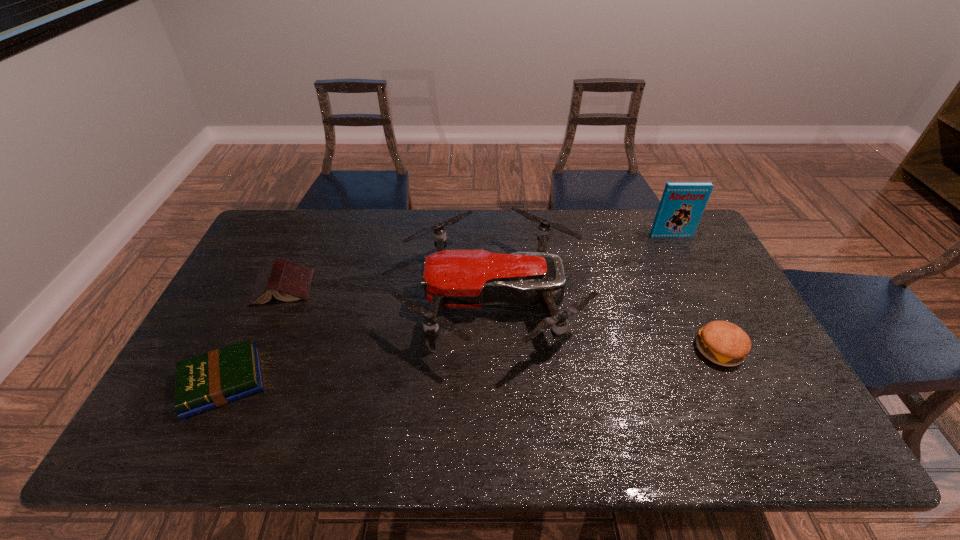
Where is `hamburger that is at the right edge`? hamburger that is at the right edge is located at coordinates (724, 343).

Identify the location of object that is at the near left corner. (213, 379).

Where is `object located at the far right corner`? This screenshot has height=540, width=960. object located at the far right corner is located at coordinates (682, 204).

I want to click on free location at the far edge of the desktop, so click(410, 244).

Find the location of a particular element. This screenshot has height=540, width=960. vacant area at the near edge is located at coordinates (340, 434).

At what (x,y) coordinates should I click in order to perform the action: click on blank space at the left edge of the desktop. Please return your answer as a coordinate pair (x, y). Looking at the image, I should click on (249, 312).

In the image, there is a desktop. What are the coordinates of `vacant area at the right edge` in the screenshot? It's located at (674, 276).

Identify the location of free location at the far right corner. This screenshot has height=540, width=960. (683, 243).

The height and width of the screenshot is (540, 960). In the image, there is a desktop. Find the location of `free space at the near right corner`. free space at the near right corner is located at coordinates (x=791, y=456).

Identify the location of vacant space that is in between the third tallest object and the second tallest object. The height and width of the screenshot is (540, 960). (607, 324).